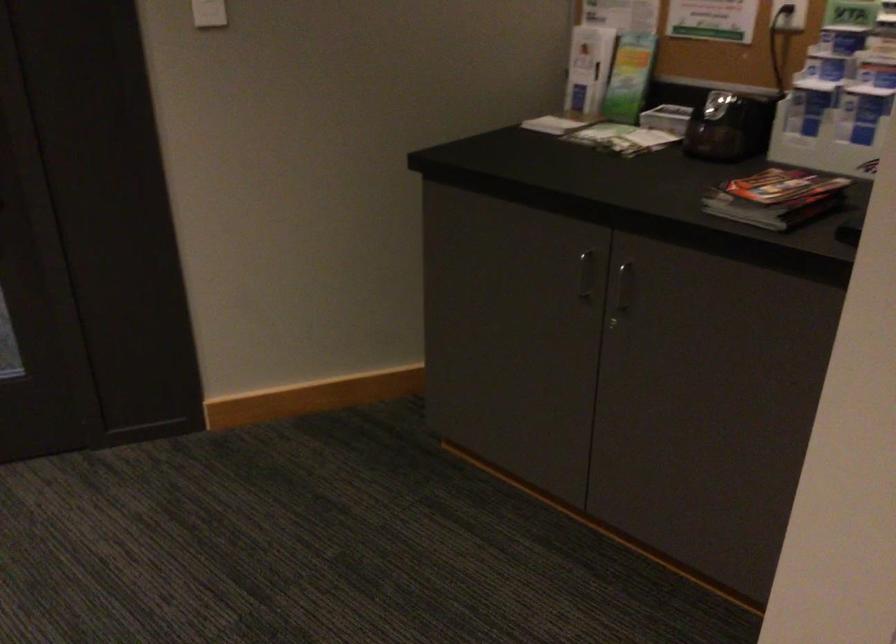
This screenshot has height=644, width=896. In order to click on stack of magazines in this screenshot , I will do `click(776, 198)`.